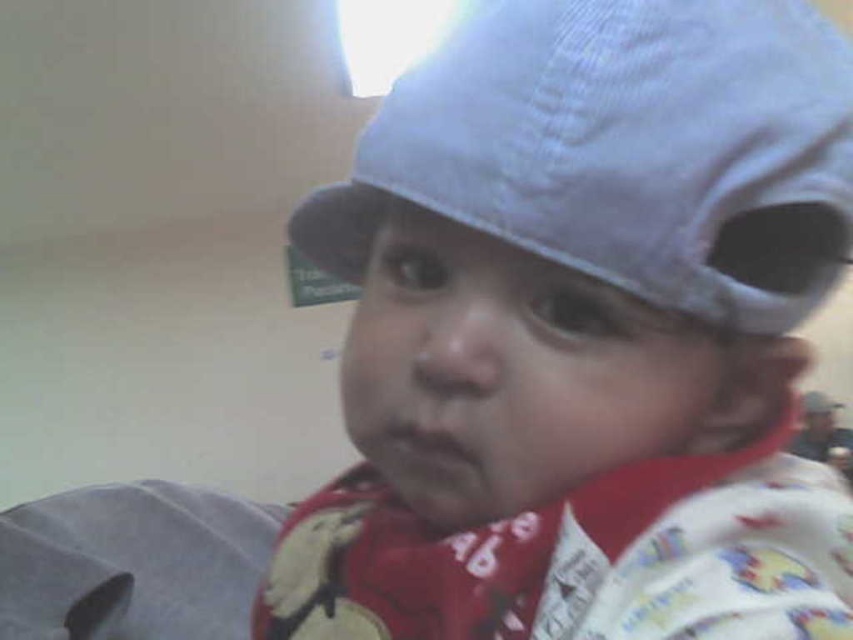
This screenshot has height=640, width=853. Describe the element at coordinates (584, 333) in the screenshot. I see `matte blue cap at center` at that location.

Which is more to the right, matte blue cap at center or blue corduroy baseball cap at upper center?

blue corduroy baseball cap at upper center is more to the right.

Find the location of a particular element. The height and width of the screenshot is (640, 853). matte blue cap at center is located at coordinates (584, 333).